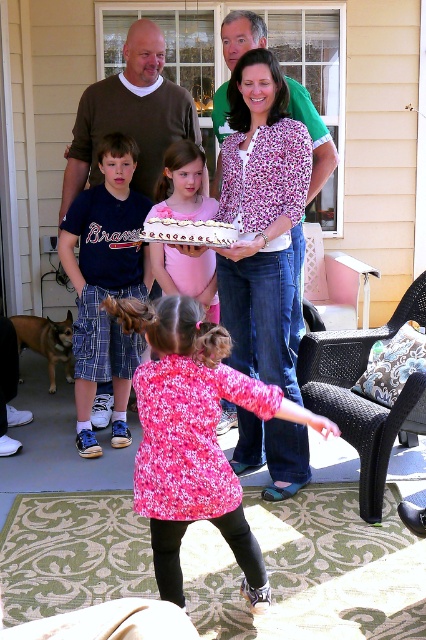
You are standing at the point labeled point (322, 140) and want to walk to the point labeled point (201, 285). Which direction should you move to get closer to your destination?

To move from point (322, 140) to point (201, 285), you should move towards the right and downward since point (201, 285) is located to the right and below point (322, 140).

You are a photographer at a family gathering on a sunny porch. You need to capture a clear shot of the white frosted cake at center without any obstructions. What should you do to ensure the brown sweater at upper left isn not blocking the cake?

Move the brown sweater at upper left away from the white frosted cake at center since it is currently positioned over it and blocking the view.